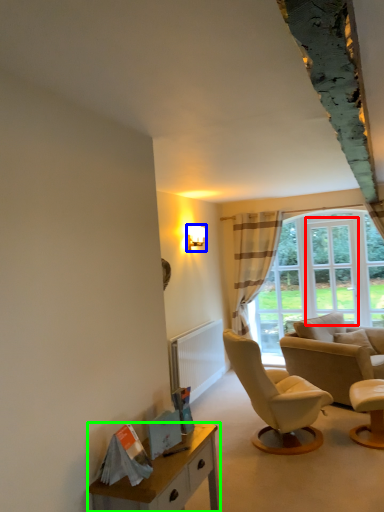
Question: Which is nearer to the window frame (highlighted by a red box)? lamp (highlighted by a blue box) or desk (highlighted by a green box).

Choices:
 (A) lamp
 (B) desk

Answer: (A)